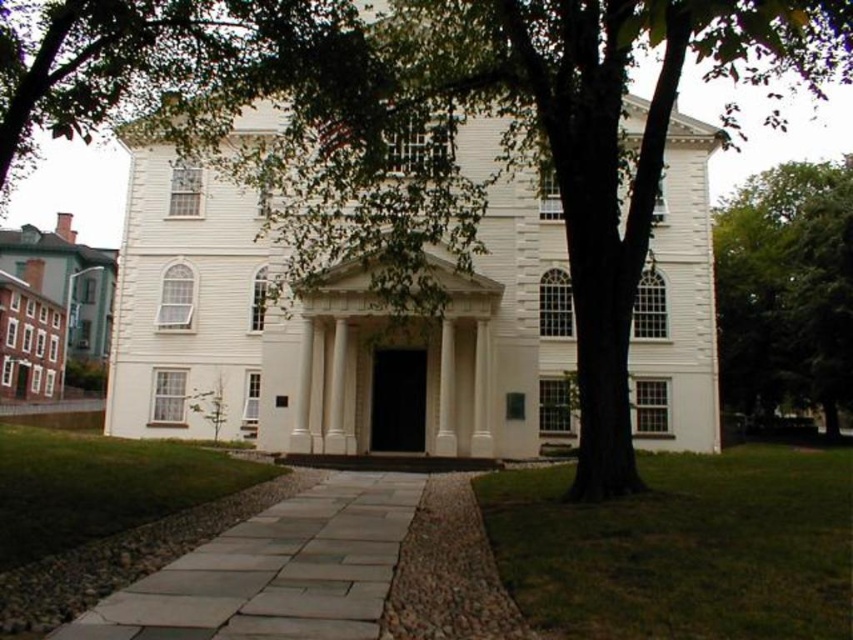
Does gray stone pathway at center lie behind green leafy tree at right?

No.

Is point (376, 554) behind point (822, 342)?

No, (376, 554) is closer to viewer.

The height and width of the screenshot is (640, 853). In order to click on gray stone pathway at center in this screenshot , I will do `click(276, 572)`.